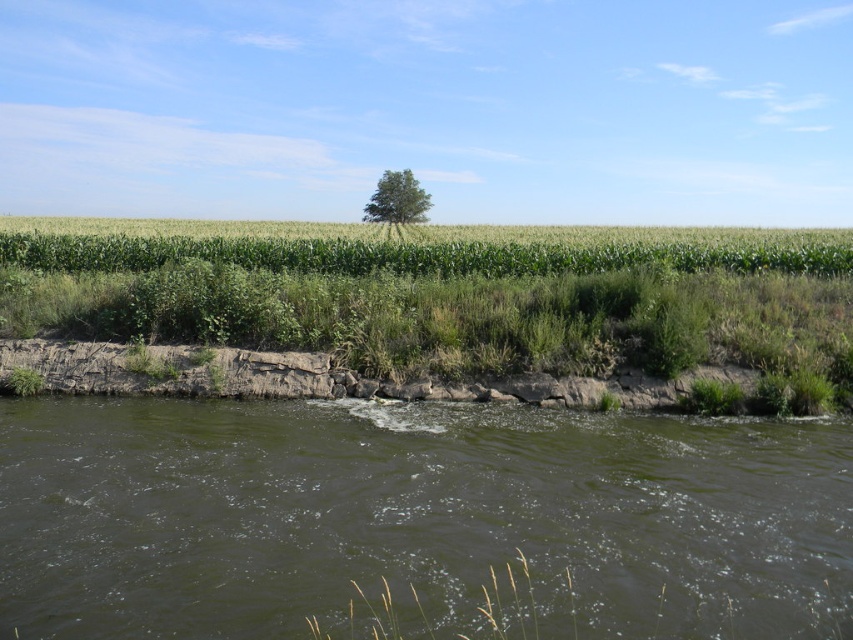
You are standing at the origin point of the coordinate system in the image. You want to walk to the green grassy field at center. Which direction should you move in to reach it?

The green grassy field at center is located at coordinate point (434, 316), which is very close to the center of the image. Since you are at the origin, you should move towards the center of the image to reach it.

You are standing at the edge of the water and want to walk to the green grassy field at center and the green leafy tree at center. Which one is closer to you?

The green leafy tree at center is closer to you because the green grassy field at center is to the right of it, meaning the tree is between you and the field.